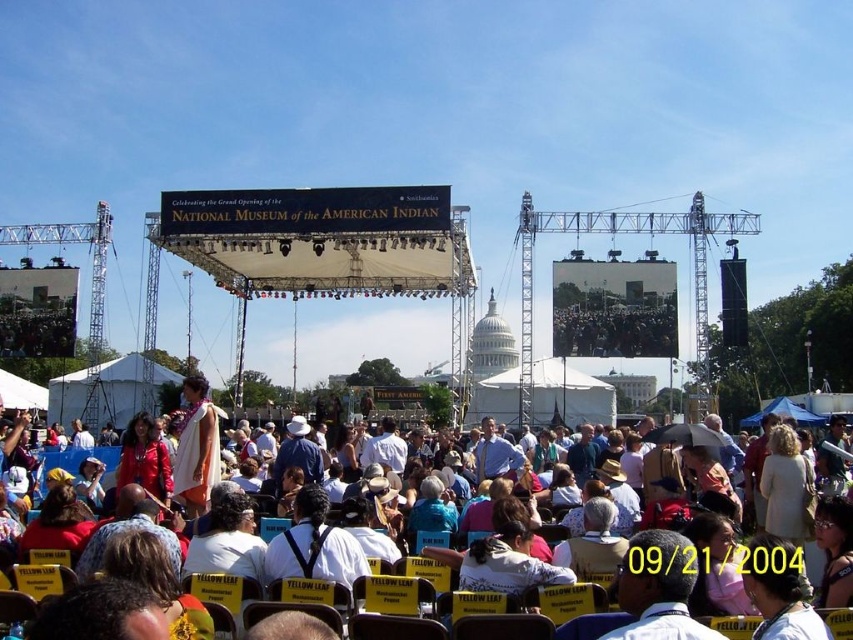
I want to click on white fabric crowd at center, so 799,620.

Who is higher up, white fabric crowd at center or black fabric backpack at center?

black fabric backpack at center is higher up.

Is point (804, 630) behind point (279, 538)?

No.

This screenshot has height=640, width=853. I want to click on white fabric crowd at center, so click(x=799, y=620).

Who is positioned more to the left, white cotton shirt at center or denim jacket at center?

From the viewer's perspective, white cotton shirt at center appears more on the left side.

You are a GUI agent. You are given a task and a screenshot of the screen. Output one action in this format:
    pyautogui.click(x=<x>, y=<y>)
    Task: Click on the white cotton shirt at center
    This screenshot has height=640, width=853.
    Given the screenshot: What is the action you would take?
    pyautogui.click(x=227, y=540)

Identify the location of white cotton shirt at center. The width and height of the screenshot is (853, 640). (227, 540).

Is white shirt at center to the left of white cotton shirt at center from the viewer's perspective?

No, white shirt at center is not to the left of white cotton shirt at center.

Which is behind, point (625, 566) or point (256, 556)?

The point (256, 556) is behind.

Which is in front, point (627, 580) or point (259, 566)?

Positioned in front is point (627, 580).

Find the location of a particular element. The width and height of the screenshot is (853, 640). white shirt at center is located at coordinates (659, 588).